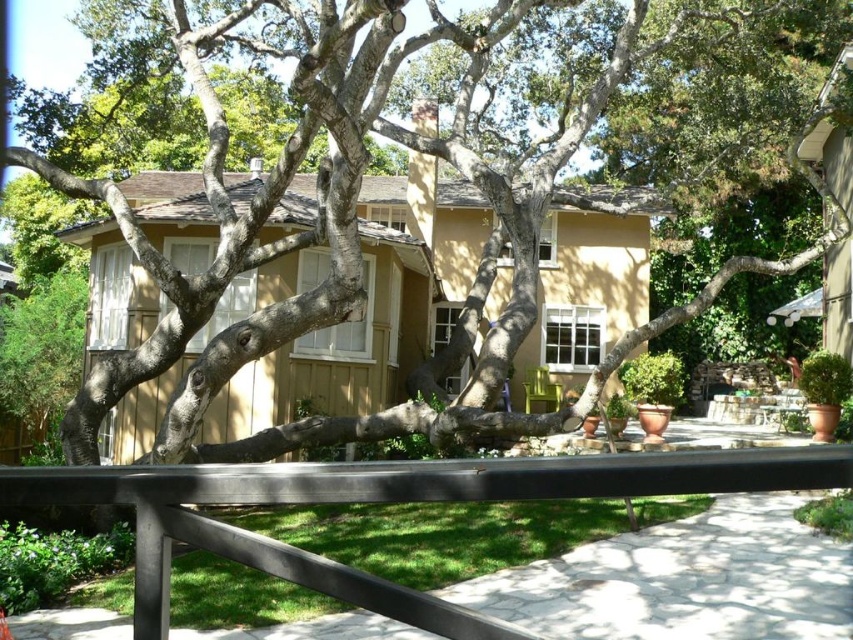
You are standing on the black metal rail at center and want to reach the brown textured tree at center. Which direction should you move to get closer to the tree?

The brown textured tree at center is positioned over the black metal rail at center, so you should move upward to get closer to the tree.

You are standing in front of the brown textured tree at center and want to walk to the black metal rail at center. Which direction should you move to reach the rail?

Since the brown textured tree at center is closer to you than the black metal rail at center, you should move forward to reach the black metal rail at center.

You are standing at the center of the image and want to walk towards the brown textured tree at center. Which direction should you move?

Since the brown textured tree at center is located at point 0.356 on the x axis and 0.415 on the y axis, you should move towards the center of the image to reach it.